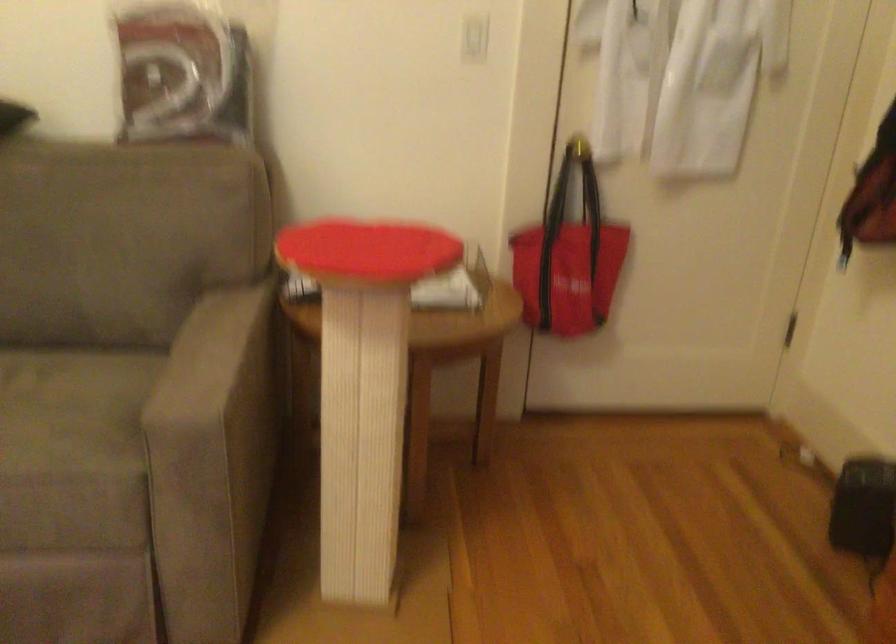
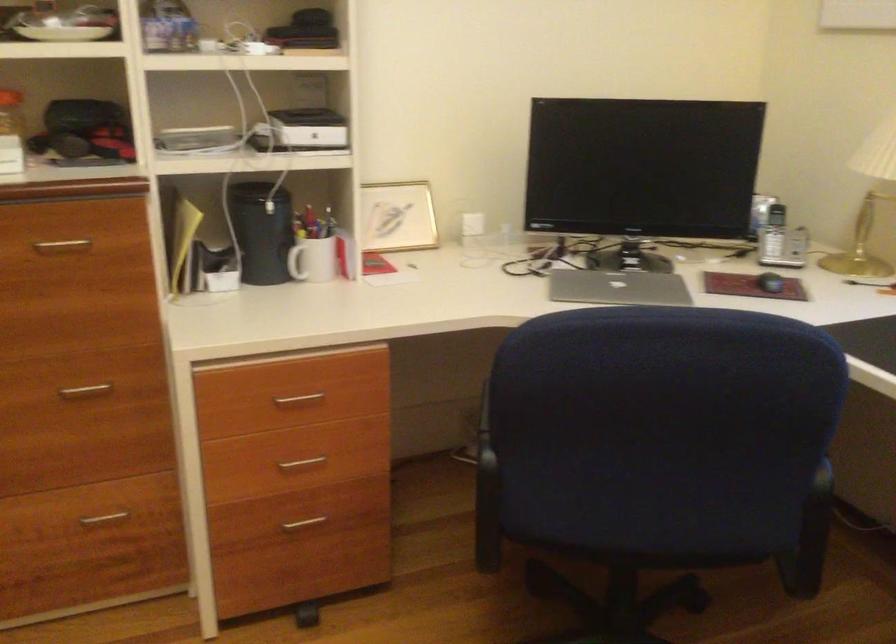
First-person continuous shooting, in which direction is the camera rotating?

The camera rotated toward right-down.